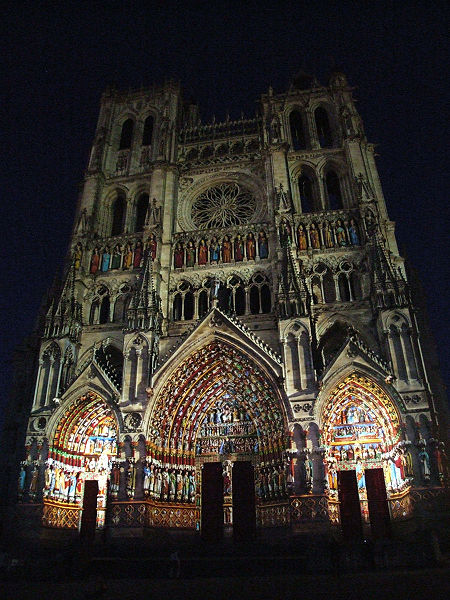
Identify the location of door. The height and width of the screenshot is (600, 450). [x=213, y=503].